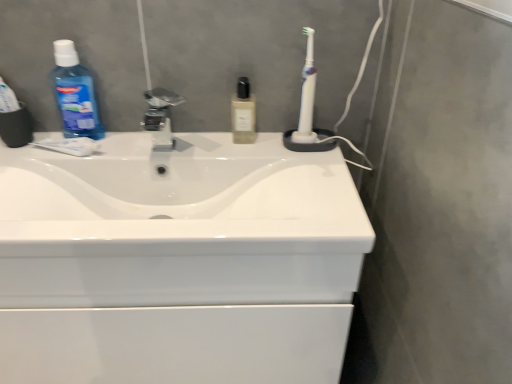
The width and height of the screenshot is (512, 384). What are the coordinates of `free location to the right of blue translucent mouthwash at left` in the screenshot? It's located at (144, 138).